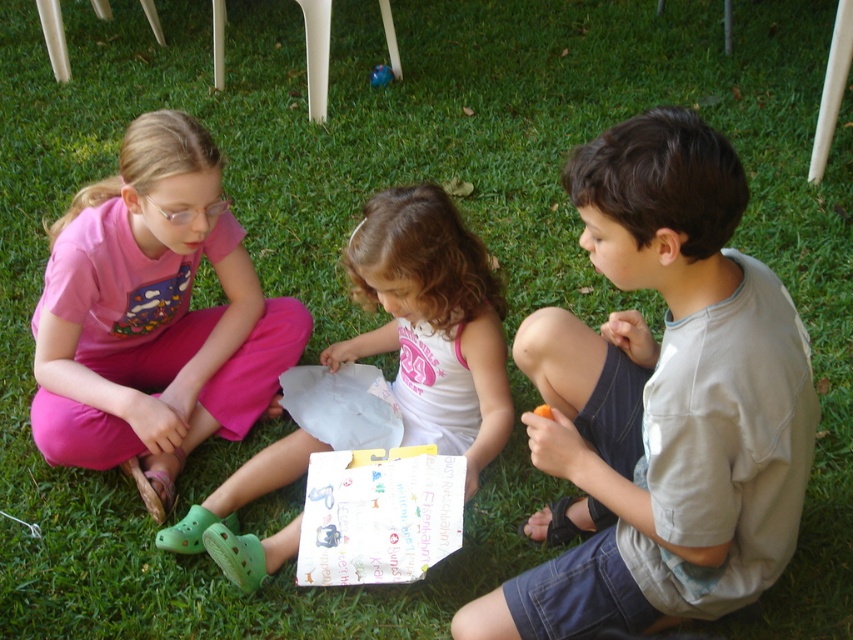
You are a fashion designer observing children playing outside. You notice two shirts among their clothing items. The light gray cotton shirt at center and the pink cotton shirt at left. Which shirt has a thinner material?

The light gray cotton shirt at center is thinner than the pink cotton shirt at left according to the description.

You are standing 5 feet away from the light gray cotton shirt at center. Can you reach it without moving your feet?

The light gray cotton shirt at center is 4.45 feet away from the viewer, so yes, you can reach it without moving your feet since it is within arm reach.